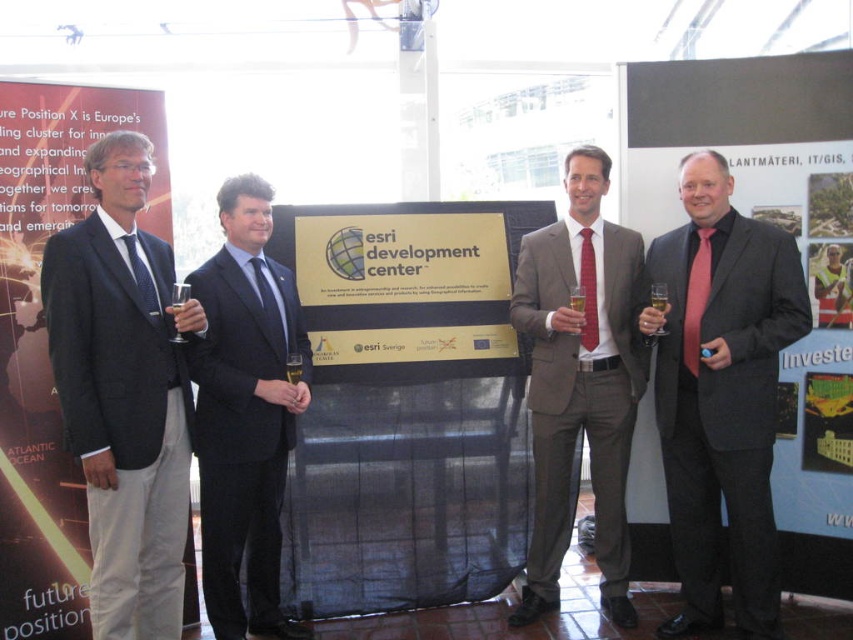
Question: Among these points, which one is farthest from the camera?

Choices:
 (A) (625, 394)
 (B) (83, 232)

Answer: (A)

Question: In this image, where is dark gray suit at left located relative to dark blue suit at center?

Choices:
 (A) below
 (B) above

Answer: (B)

Question: Is dark gray suit at left further to camera compared to dark blue suit at center?

Choices:
 (A) no
 (B) yes

Answer: (A)

Question: Is matte black suit at right above matte gray suit at center?

Choices:
 (A) no
 (B) yes

Answer: (A)

Question: Which point is closer to the camera taking this photo?

Choices:
 (A) (90, 406)
 (B) (270, 234)
 (C) (567, 524)

Answer: (A)

Question: Which object is closer to the camera taking this photo?

Choices:
 (A) matte black suit at right
 (B) matte gray suit at center
 (C) dark blue suit at center
 (D) dark gray suit at left

Answer: (D)